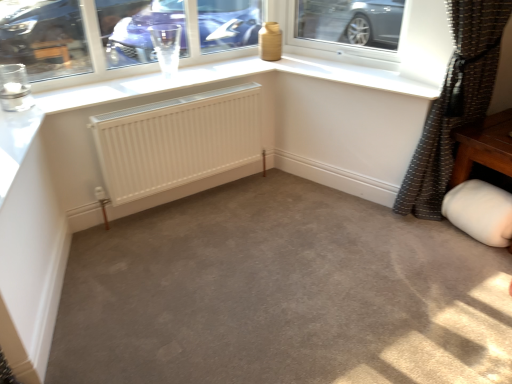
In order to click on vacant region in front of white matte radiator at center in this screenshot , I will do `click(192, 270)`.